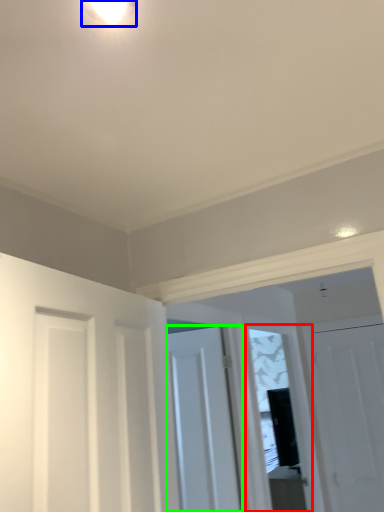
Question: Which is farther away from window (highlighted by a red box)? light fixture (highlighted by a blue box) or door (highlighted by a green box)?

Choices:
 (A) light fixture
 (B) door

Answer: (A)